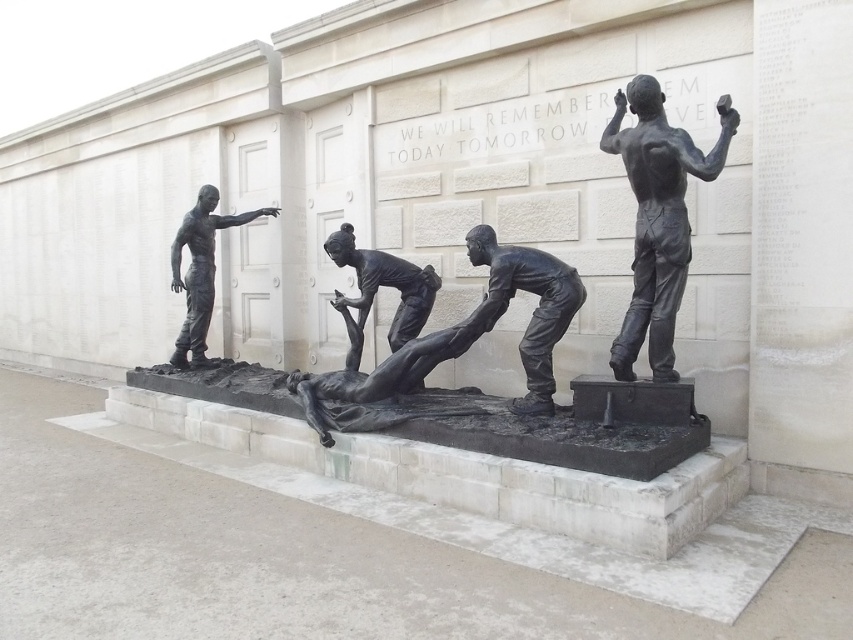
You are an art student analyzing the bronze sculpture. You notice two figures, the bronze figure at center and the bronze statue at left. Which one is shorter?

The bronze figure at center is shorter than the bronze statue at left.

You are standing in front of the sculpture and want to take a photo that includes both the bronze statue at left and the bronze statue of person at center. Which statue should you look up towards to ensure both are in the frame?

You should look up towards the bronze statue at left since it is located above the bronze statue of person at center, ensuring both are visible in the frame.